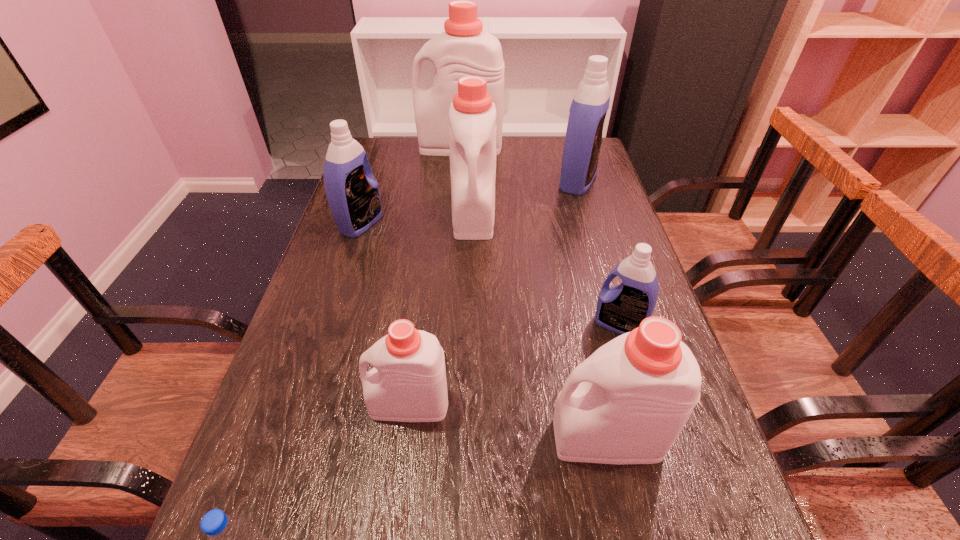
The image size is (960, 540). Identify the location of vacant point located 0.060m on the handle side of the farthest detergent. (401, 146).

Locate an element on the screen. vacant area situated 0.110m on the handle side of the farthest detergent is located at coordinates (387, 146).

Where is `vacant space located 0.190m on the handle side of the farthest detergent`? vacant space located 0.190m on the handle side of the farthest detergent is located at coordinates (365, 146).

Where is `vacant space located 0.170m on the handle side of the third nearest white detergent`? The height and width of the screenshot is (540, 960). vacant space located 0.170m on the handle side of the third nearest white detergent is located at coordinates (472, 286).

This screenshot has height=540, width=960. Find the location of `free space located on the left of the biggest blue detergent`. free space located on the left of the biggest blue detergent is located at coordinates (487, 181).

At what (x,y) coordinates should I click in order to perform the action: click on free space located on the back of the leftmost detergent. Please return your answer as a coordinate pair (x, y). This screenshot has height=540, width=960. Looking at the image, I should click on (386, 146).

In order to click on vacant space located on the handle side of the rightmost white detergent in this screenshot , I will do `click(390, 438)`.

Identify the location of vacant space positioned 0.240m on the handle side of the rightmost white detergent. The height and width of the screenshot is (540, 960). (418, 438).

Where is `vacant region located on the handle side of the rightmost white detergent`? vacant region located on the handle side of the rightmost white detergent is located at coordinates (495, 438).

Identify the location of vacant space positioned 0.160m on the handle side of the smallest white detergent. The image size is (960, 540). (286, 404).